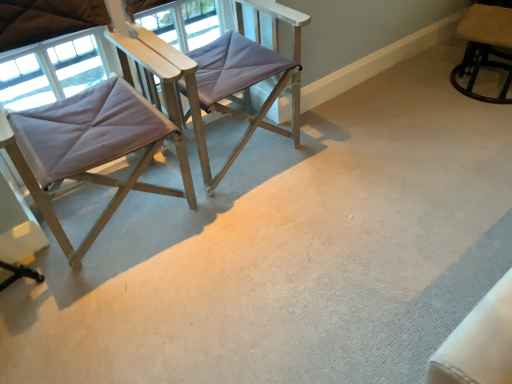
This screenshot has height=384, width=512. I want to click on free space that is in between beige fabric chair at upper right, the first chair when ordered from right to left, and matte purple fabric chair at center, marked as the 2th chair in a right-to-left arrangement, so click(382, 125).